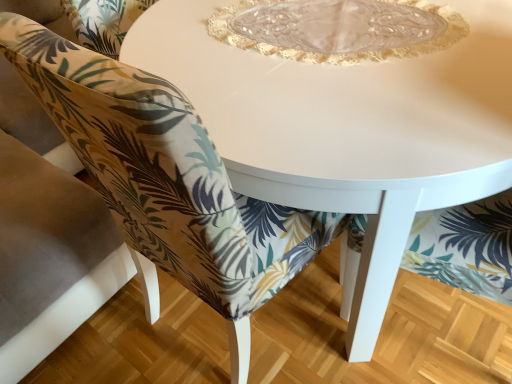
The height and width of the screenshot is (384, 512). I want to click on vacant space underneath transparent glass plate at center (from a real-world perspective), so click(x=342, y=28).